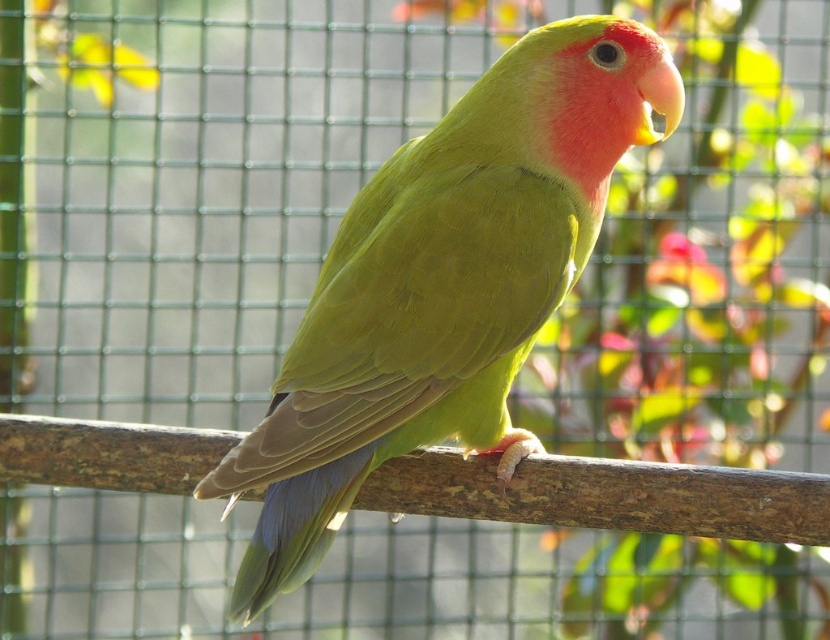
You are standing in front of a parrot enclosure. There is a point at coordinates (443, 285). What object in the enclosure is located at that point?

The point at coordinates (443, 285) corresponds to the green matte parrot at center.

You are a small toy that is 2 inches long. You want to place yourself between the green matte parrot at center and the brown wood at center. Is there enough space for you to fit in that area?

The distance between the green matte parrot at center and the brown wood at center is 8.24 inches, so yes, the toy can fit in between them since it is only 2 inches long.